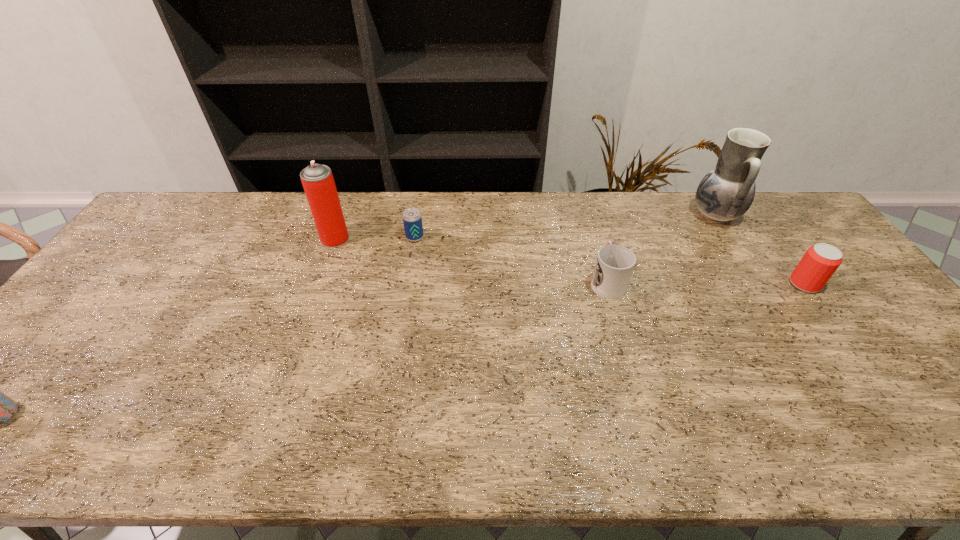
You are a GUI agent. You are given a task and a screenshot of the screen. Output one action in this format:
    pyautogui.click(x=<x>, y=<y>)
    Task: Click on the vacant region between the aerosol can and the cup
    
    Given the screenshot: What is the action you would take?
    pyautogui.click(x=471, y=260)

You are a GUI agent. You are given a task and a screenshot of the screen. Output one action in this format:
    pyautogui.click(x=<x>, y=<y>)
    Task: Click on the vacant point located between the second farthest beer can and the fifth object from right to left
    Image resolution: width=960 pixels, height=540 pixels.
    Given the screenshot: What is the action you would take?
    pyautogui.click(x=569, y=261)

You are a GUI agent. You are given a task and a screenshot of the screen. Output one action in this format:
    pyautogui.click(x=<x>, y=<y>)
    Task: Click on the vacant space that's between the second object from right to left and the third object from right to left
    The image size is (960, 540).
    Given the screenshot: What is the action you would take?
    pyautogui.click(x=661, y=248)

The height and width of the screenshot is (540, 960). I want to click on object that ranks as the third closest to the pitcher, so [x=412, y=219].

Where is `object that is the third closest to the farthest beer can`? This screenshot has width=960, height=540. object that is the third closest to the farthest beer can is located at coordinates (726, 192).

Point out which beer can is positioned as the second nearest to the aerosol can. Please provide its 2D coordinates. Your answer should be formatted as a tuple, i.e. [(x, y)], where the tuple contains the x and y coordinates of a point satisfying the conditions above.

[(0, 408)]

You are a GUI agent. You are given a task and a screenshot of the screen. Output one action in this format:
    pyautogui.click(x=<x>, y=<y>)
    Task: Click on the beer can that is the second closest to the leftmost object
    This screenshot has width=960, height=540.
    Given the screenshot: What is the action you would take?
    pyautogui.click(x=819, y=263)

This screenshot has width=960, height=540. What are the coordinates of `free spot that satisfies the following two spatial constraints: 1. on the front side of the second beer can from right to left; 2. on the left side of the rightmost object` in the screenshot? It's located at (407, 284).